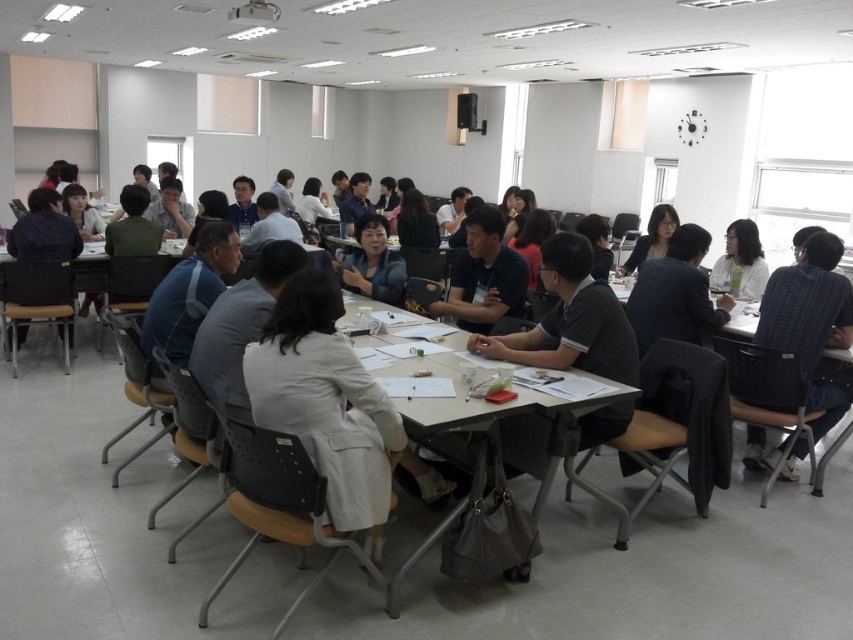
Question: Among these objects, which one is nearest to the camera?

Choices:
 (A) plaid fabric shirt at right
 (B) matte black jacket at left
 (C) white fabric jacket at center

Answer: (C)

Question: Considering the relative positions of matte black jacket at left and light blue shirt at center in the image provided, where is matte black jacket at left located with respect to light blue shirt at center?

Choices:
 (A) left
 (B) right

Answer: (A)

Question: Which of these objects is positioned farthest from the white fabric jacket at center?

Choices:
 (A) matte black shirt at center
 (B) light blue shirt at center
 (C) matte black jacket at upper right
 (D) white paper at center

Answer: (C)

Question: Can you confirm if matte black shirt at center is wider than white matte jacket at center?

Choices:
 (A) yes
 (B) no

Answer: (A)

Question: Considering the real-world distances, which object is farthest from the matte black jacket at upper right?

Choices:
 (A) light blue shirt at center
 (B) matte black shirt at center

Answer: (A)

Question: Does matte black jacket at left appear on the right side of white matte jacket at center?

Choices:
 (A) no
 (B) yes

Answer: (A)